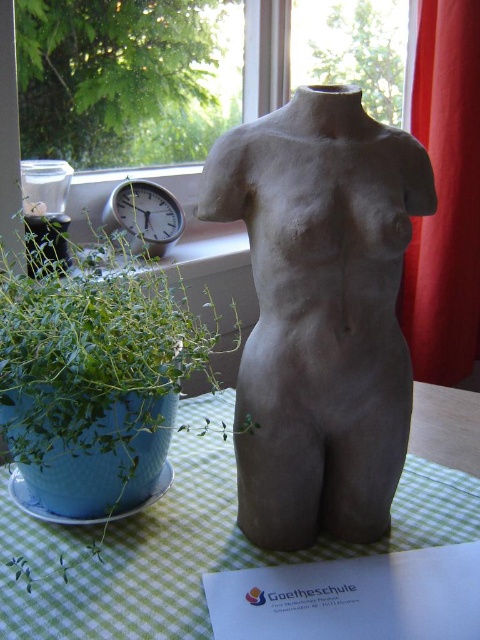
Question: Which of these objects is positioned closest to the green matte plant at left?

Choices:
 (A) matte gray torso at center
 (B) silver metallic clock at left
 (C) green checkered tablecloth at center
 (D) red fabric curtain at right

Answer: (A)

Question: Can you confirm if green matte plant at left is bigger than green checkered tablecloth at center?

Choices:
 (A) yes
 (B) no

Answer: (A)

Question: Does green checkered tablecloth at center come in front of silver metallic clock at left?

Choices:
 (A) no
 (B) yes

Answer: (B)

Question: Which of the following is the closest to the observer?

Choices:
 (A) (351, 445)
 (B) (112, 202)
 (C) (432, 368)

Answer: (A)

Question: Can you confirm if red fabric curtain at right is positioned to the left of silver metallic clock at left?

Choices:
 (A) no
 (B) yes

Answer: (A)

Question: Which point is closer to the camera taking this photo?

Choices:
 (A) (263, 516)
 (B) (130, 600)

Answer: (B)